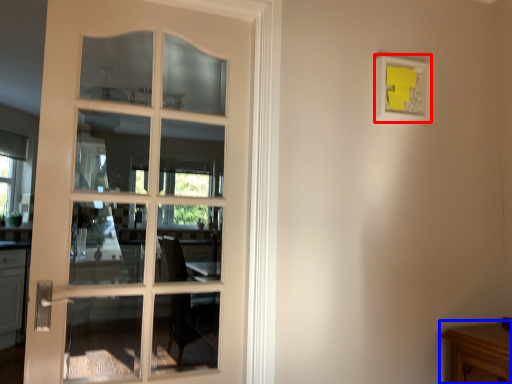
Question: Among these objects, which one is farthest to the camera, picture frame (highlighted by a red box) or table (highlighted by a blue box)?

Choices:
 (A) picture frame
 (B) table

Answer: (A)